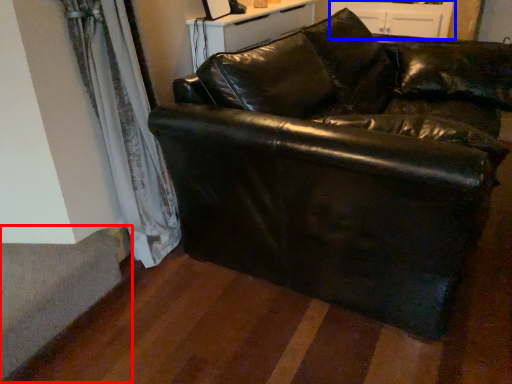
Question: Which object appears farthest to the camera in this image, stairwell (highlighted by a red box) or dresser (highlighted by a blue box)?

Choices:
 (A) stairwell
 (B) dresser

Answer: (B)